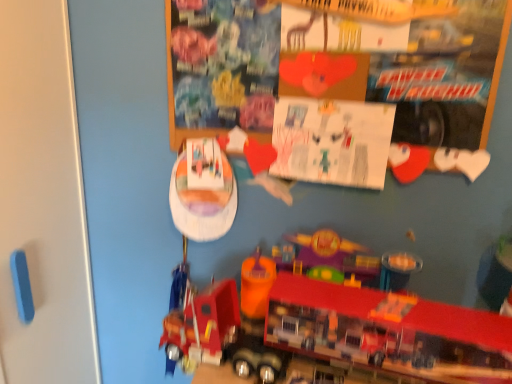
Question: From the image's perspective, is wooden bulletin board at upper center located above or below metallic red truck at lower center?

Choices:
 (A) above
 (B) below

Answer: (A)

Question: From their relative heights in the image, would you say wooden bulletin board at upper center is taller or shorter than metallic red truck at lower center?

Choices:
 (A) tall
 (B) short

Answer: (A)

Question: Based on their relative distances, which object is farther from the wooden bulletin board at upper center?

Choices:
 (A) white paper at upper center
 (B) metallic red truck at lower center

Answer: (B)

Question: Based on their relative distances, which object is nearer to the wooden bulletin board at upper center?

Choices:
 (A) white paper at upper center
 (B) metallic red truck at lower center

Answer: (A)